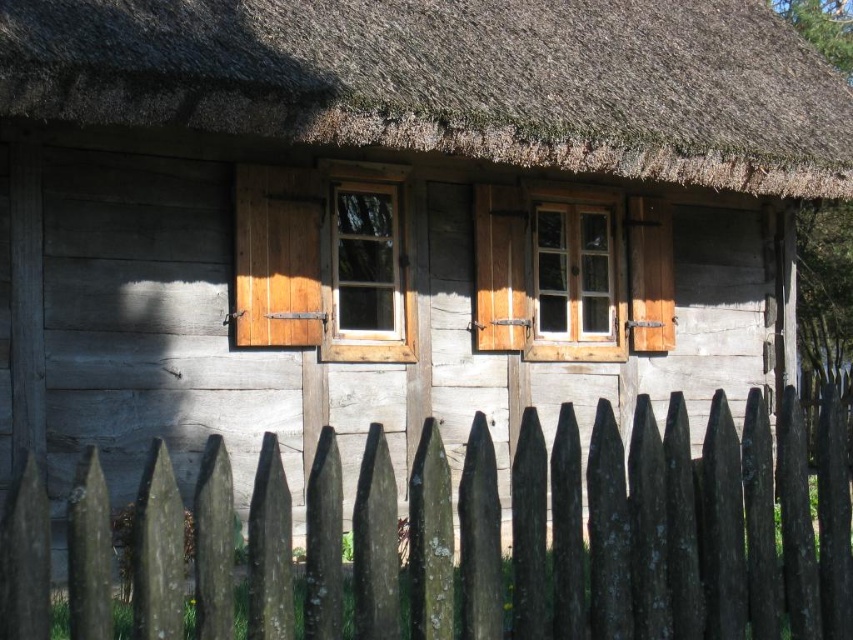
This screenshot has width=853, height=640. Describe the element at coordinates (682, 528) in the screenshot. I see `weathered wood fence at center` at that location.

Is weathered wood fence at center to the left of white wood window at center from the viewer's perspective?

Yes, weathered wood fence at center is to the left of white wood window at center.

Locate an element on the screen. This screenshot has width=853, height=640. weathered wood fence at center is located at coordinates (682, 528).

Is weathered wood fence at center above wooden window at center?

No, weathered wood fence at center is not above wooden window at center.

Between weathered wood fence at center and wooden window at center, which one appears on the left side from the viewer's perspective?

wooden window at center

The height and width of the screenshot is (640, 853). Describe the element at coordinates (682, 528) in the screenshot. I see `weathered wood fence at center` at that location.

Where is `weathered wood fence at center`? weathered wood fence at center is located at coordinates (682, 528).

I want to click on weathered wood fence at center, so click(682, 528).

Is weathered wood fence at center above brown thatch at upper center?

No, weathered wood fence at center is not above brown thatch at upper center.

Locate an element on the screen. weathered wood fence at center is located at coordinates (682, 528).